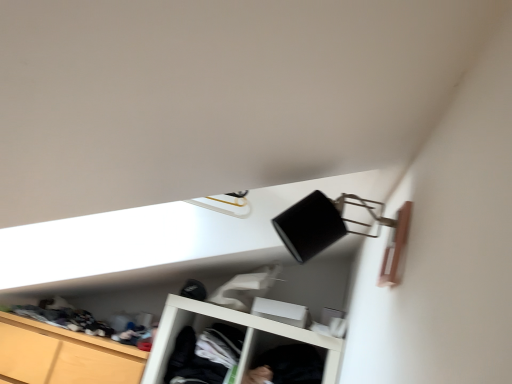
Question: From a real-world perspective, is black cotton shirt at lower center, the second clothing viewed from the left, on dark gray fabric at center, the second clothing when ordered from right to left?

Choices:
 (A) no
 (B) yes

Answer: (B)

Question: Does black cotton shirt at lower center, the second clothing viewed from the left, have a lesser width compared to dark gray fabric at center, the first clothing when ordered from left to right?

Choices:
 (A) yes
 (B) no

Answer: (A)

Question: From the image's perspective, would you say black cotton shirt at lower center, the second clothing viewed from the left, is positioned over dark gray fabric at center, the second clothing when ordered from right to left?

Choices:
 (A) no
 (B) yes

Answer: (A)

Question: Are black cotton shirt at lower center, the second clothing viewed from the left, and dark gray fabric at center, the first clothing when ordered from left to right, beside each other?

Choices:
 (A) no
 (B) yes

Answer: (A)

Question: Is black cotton shirt at lower center, the second clothing viewed from the left, to the left of dark gray fabric at center, the first clothing when ordered from left to right, from the viewer's perspective?

Choices:
 (A) yes
 (B) no

Answer: (B)

Question: Considering the relative positions of wooden cabinet at lower left and black cotton shirt at lower center, the second clothing viewed from the left, in the image provided, is wooden cabinet at lower left to the left or to the right of black cotton shirt at lower center, the second clothing viewed from the left,?

Choices:
 (A) left
 (B) right

Answer: (A)

Question: From a real-world perspective, is wooden cabinet at lower left physically located above or below black cotton shirt at lower center, the second clothing viewed from the left?

Choices:
 (A) below
 (B) above

Answer: (A)

Question: From the image's perspective, is wooden cabinet at lower left above or below black cotton shirt at lower center, the first clothing when ordered from right to left?

Choices:
 (A) above
 (B) below

Answer: (B)

Question: Is wooden cabinet at lower left inside or outside of black cotton shirt at lower center, the first clothing when ordered from right to left?

Choices:
 (A) inside
 (B) outside

Answer: (B)

Question: Would you say dark gray fabric at center, the first clothing when ordered from left to right, is to the left or to the right of wooden cabinet at lower left in the picture?

Choices:
 (A) right
 (B) left

Answer: (A)

Question: Considering their positions, is dark gray fabric at center, the second clothing when ordered from right to left, located in front of or behind wooden cabinet at lower left?

Choices:
 (A) front
 (B) behind

Answer: (B)

Question: Is dark gray fabric at center, the first clothing when ordered from left to right, situated inside wooden cabinet at lower left or outside?

Choices:
 (A) inside
 (B) outside

Answer: (B)

Question: Considering the positions of dark gray fabric at center, the first clothing when ordered from left to right, and wooden cabinet at lower left in the image, is dark gray fabric at center, the first clothing when ordered from left to right, taller or shorter than wooden cabinet at lower left?

Choices:
 (A) short
 (B) tall

Answer: (A)

Question: Looking at the image, does black cotton shirt at lower center, the first clothing when ordered from right to left, seem bigger or smaller compared to wooden cabinet at lower left?

Choices:
 (A) small
 (B) big

Answer: (A)

Question: From a real-world perspective, is black cotton shirt at lower center, the second clothing viewed from the left, physically located above or below wooden cabinet at lower left?

Choices:
 (A) above
 (B) below

Answer: (A)